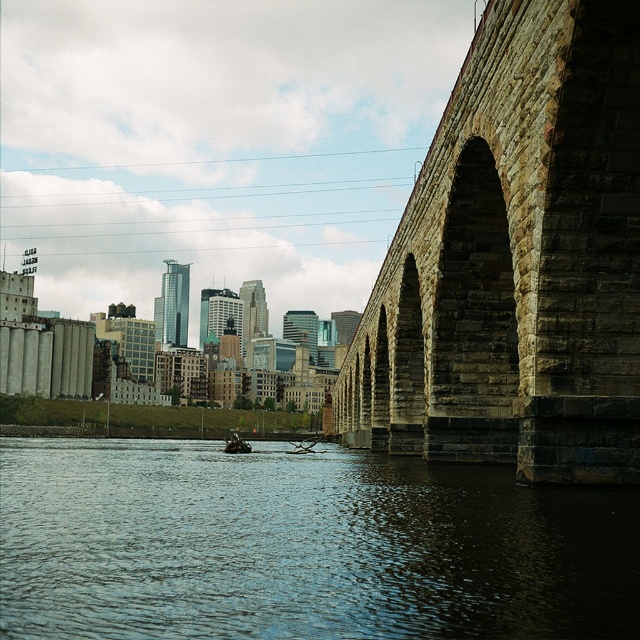
Question: Which object appears closest to the camera in this image?

Choices:
 (A) stone arch bridge at right
 (B) dark blue water at center

Answer: (B)

Question: Which of the following is the closest to the observer?

Choices:
 (A) stone arch bridge at right
 (B) green plastic boat at center

Answer: (A)

Question: Is stone arch bridge at right below green plastic boat at center?

Choices:
 (A) yes
 (B) no

Answer: (B)

Question: Which object is positioned farthest from the stone arch bridge at right?

Choices:
 (A) green plastic boat at center
 (B) dark blue water at center

Answer: (A)

Question: Is dark blue water at center below green plastic boat at center?

Choices:
 (A) no
 (B) yes

Answer: (A)

Question: Does stone arch bridge at right have a smaller size compared to green plastic boat at center?

Choices:
 (A) yes
 (B) no

Answer: (A)